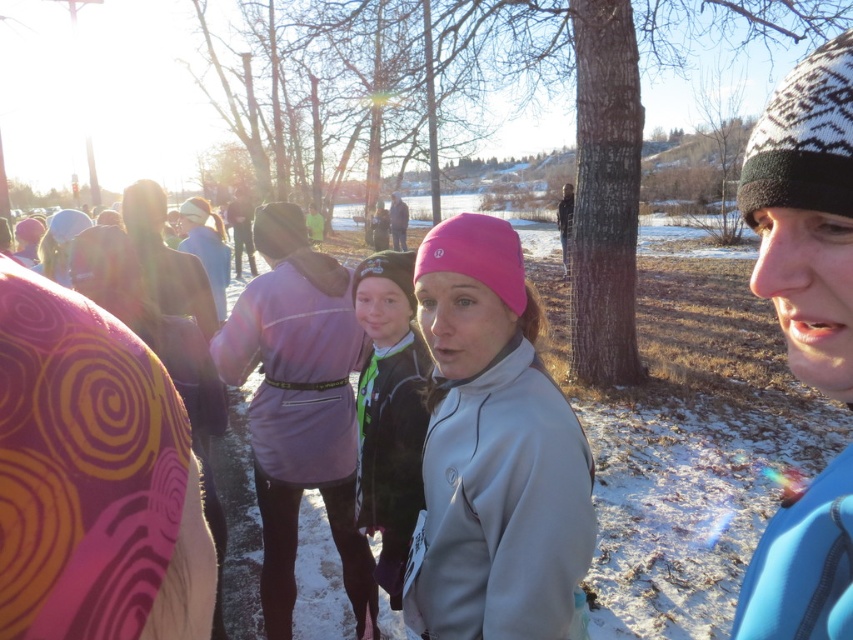
Question: Which point is closer to the camera?

Choices:
 (A) white knit hat at right
 (B) pink fabric headband at center

Answer: (A)

Question: Which object is closer to the camera taking this photo?

Choices:
 (A) white knit hat at right
 (B) black fleece jacket at center
 (C) purple fleece jacket at center
 (D) pink fabric headband at center

Answer: (A)

Question: Among these points, which one is nearest to the camera?

Choices:
 (A) pos(795,508)
 (B) pos(410,483)

Answer: (A)

Question: In this image, where is pink fabric headband at center located relative to black fleece jacket at center?

Choices:
 (A) below
 (B) above

Answer: (B)

Question: Observing the image, what is the correct spatial positioning of white knit hat at right in reference to black fleece jacket at center?

Choices:
 (A) left
 (B) right

Answer: (B)

Question: Is purple fleece jacket at center closer to the viewer compared to black fleece jacket at center?

Choices:
 (A) no
 (B) yes

Answer: (A)